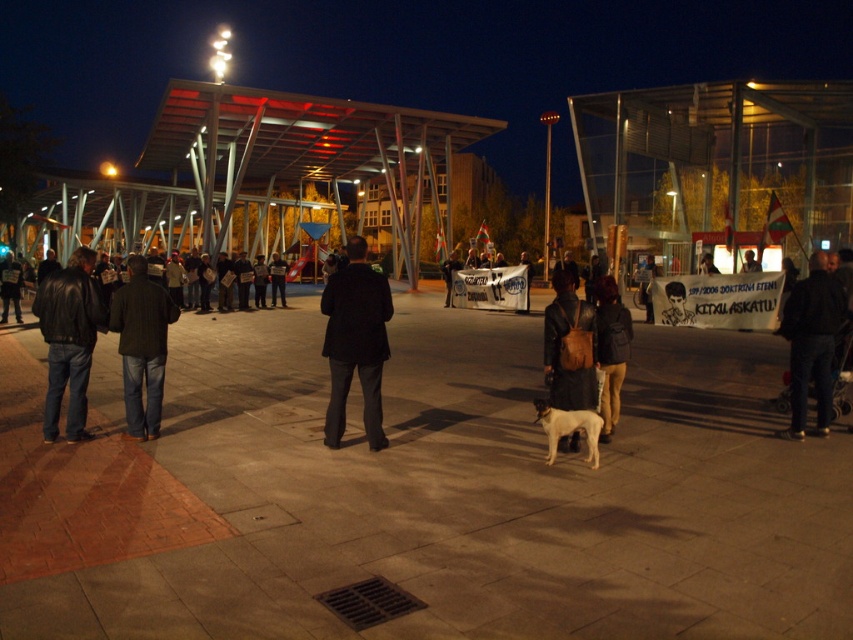
You are standing in the plaza and notice two people wearing dark blue jeans at left and dark blue jeans at center. Which person is closer to the ground?

The dark blue jeans at left is located below dark blue jeans at center, so the person wearing dark blue jeans at left is closer to the ground.

You are standing at the bottom center of the image where the drain grate is located. You want to walk towards the dark blue jeans at left. Which direction should you head?

You should head to the left direction to reach the dark blue jeans at left since its 2D location is at point (141,346) which is to the left side of the image.

In the scene shown: You are standing in the plaza and want to approach the person wearing dark blue jeans at center. Which direction should you move to get closer to them without passing the dark blue jeans at left?

You should move to the right side because the dark blue jeans at left is closer to you, so moving right would allow you to bypass them and reach the dark blue jeans at center.